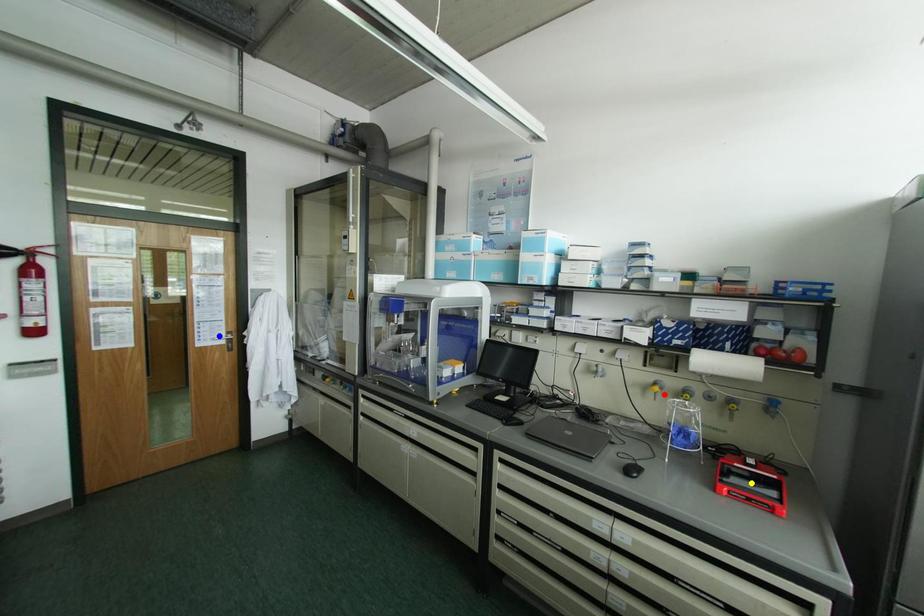
Order these from farthest to nearest:
A) blue point
B) yellow point
C) red point

1. blue point
2. red point
3. yellow point